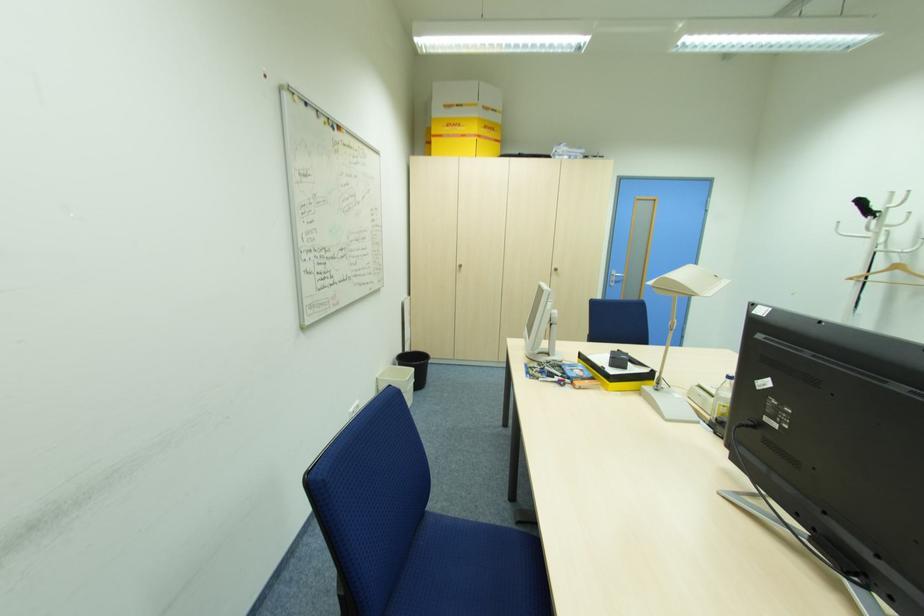
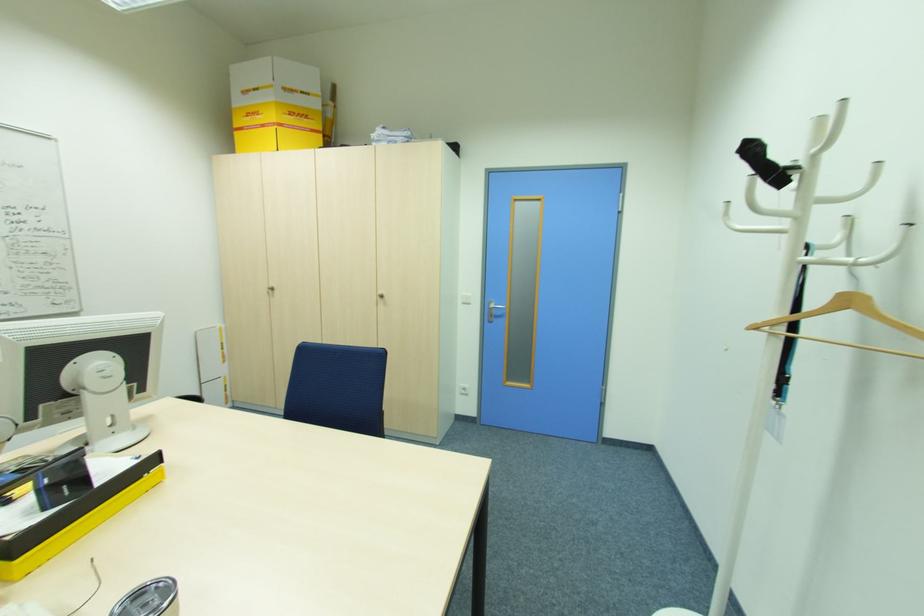
Which direction would the cameraman need to move to produce the second image?

The cameraman walked toward right, forward.